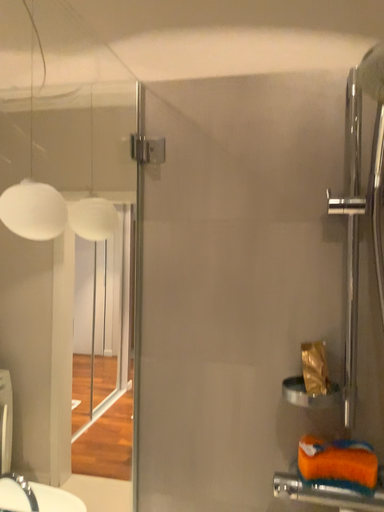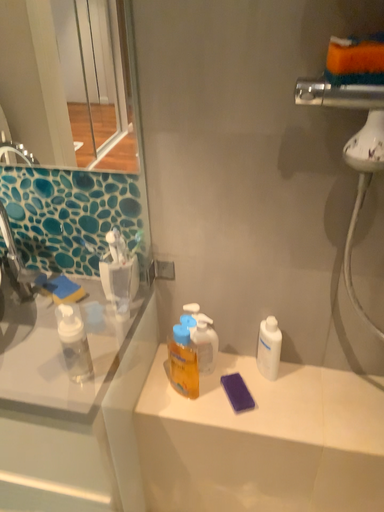
Question: Which way did the camera rotate in the video?

Choices:
 (A) rotated downward
 (B) rotated upward

Answer: (A)